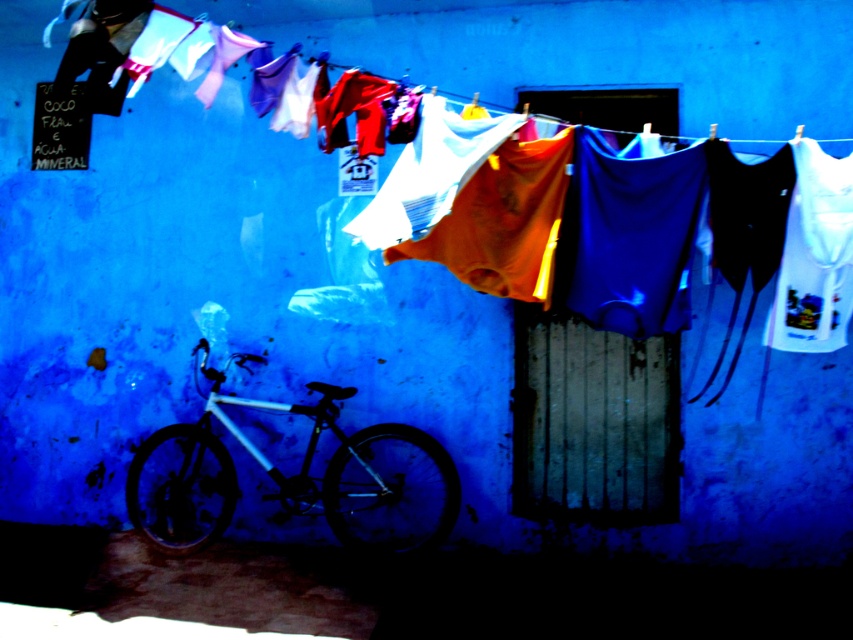
Is orange fabric at center thinner than matte fabric clothesline at upper center?

In fact, orange fabric at center might be wider than matte fabric clothesline at upper center.

Does orange fabric at center appear on the left side of matte fabric clothesline at upper center?

Incorrect, orange fabric at center is not on the left side of matte fabric clothesline at upper center.

Is point (776, 22) positioned behind point (750, 122)?

That is True.

Where is `orange fabric at center`? orange fabric at center is located at coordinates (212, 273).

Which of these two, orange fabric at center or white printed t-shirt at right, stands taller?

With more height is orange fabric at center.

What do you see at coordinates (212, 273) in the screenshot? I see `orange fabric at center` at bounding box center [212, 273].

In order to click on orange fabric at center in this screenshot , I will do `click(212, 273)`.

Which is below, matte fabric clothesline at upper center or silver metallic bicycle at lower left?

silver metallic bicycle at lower left is lower down.

Between point (49, 176) and point (349, 458), which one is positioned behind?

Positioned behind is point (49, 176).

Identify the location of matte fabric clothesline at upper center. This screenshot has width=853, height=640. tap(590, 51).